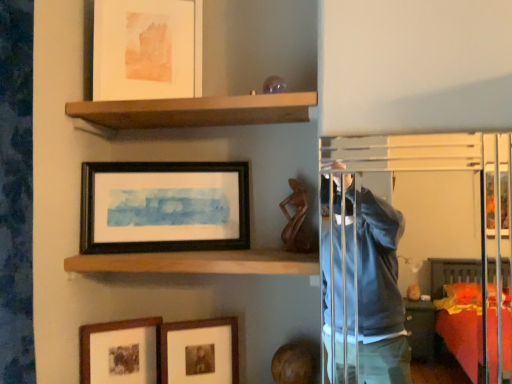
Where is `wooden shelf at center, the 2th shelf positioned from the top`? wooden shelf at center, the 2th shelf positioned from the top is located at coordinates (199, 262).

What do you see at coordinates (292, 364) in the screenshot? I see `wooden head at lower center` at bounding box center [292, 364].

What do you see at coordinates (147, 49) in the screenshot? This screenshot has width=512, height=384. I see `matte paper picture frame at upper center, the first picture frame when ordered from top to bottom` at bounding box center [147, 49].

What are the coordinates of `wooden shelf at center, the 2th shelf positioned from the top` in the screenshot? It's located at (199, 262).

You are a GUI agent. You are given a task and a screenshot of the screen. Output one action in this format:
    pyautogui.click(x=<x>, y=<y>)
    Task: Click on the picture frame that is the 3rd object to the right of the matte wooden picture frame at lower left, marked as the 1th picture frame in a bottom-to-top arrangement, starting at the anchor
    The image size is (512, 384).
    Given the screenshot: What is the action you would take?
    pyautogui.click(x=200, y=351)

From the image's perspective, does matte wooden picture frame at lower center, acting as the third picture frame starting from the top, appear lower than matte wooden picture frame at lower left, the fourth picture frame from the top?

Incorrect, from the image's perspective, matte wooden picture frame at lower center, acting as the third picture frame starting from the top, is higher than matte wooden picture frame at lower left, the fourth picture frame from the top.

From a real-world perspective, is matte wooden picture frame at lower center, which appears as the 2th picture frame when ordered from the bottom, positioned above or below matte wooden picture frame at lower left, marked as the 1th picture frame in a bottom-to-top arrangement?

In terms of real-world spatial position, matte wooden picture frame at lower center, which appears as the 2th picture frame when ordered from the bottom, is above matte wooden picture frame at lower left, marked as the 1th picture frame in a bottom-to-top arrangement.

Is matte wooden picture frame at lower center, acting as the third picture frame starting from the top, touching matte wooden picture frame at lower left, marked as the 1th picture frame in a bottom-to-top arrangement?

matte wooden picture frame at lower center, acting as the third picture frame starting from the top, and matte wooden picture frame at lower left, marked as the 1th picture frame in a bottom-to-top arrangement, are clearly separated.

In terms of size, does matte paper picture frame at upper center, the first picture frame when ordered from top to bottom, appear bigger or smaller than matte wooden picture frame at lower center, which appears as the 2th picture frame when ordered from the bottom?

Considering their sizes, matte paper picture frame at upper center, the first picture frame when ordered from top to bottom, takes up more space than matte wooden picture frame at lower center, which appears as the 2th picture frame when ordered from the bottom.

Could you tell me if matte paper picture frame at upper center, the first picture frame when ordered from top to bottom, is turned towards matte wooden picture frame at lower center, acting as the third picture frame starting from the top?

No, matte paper picture frame at upper center, the first picture frame when ordered from top to bottom, is not facing towards matte wooden picture frame at lower center, acting as the third picture frame starting from the top.

From the picture: Is matte paper picture frame at upper center, the first picture frame when ordered from top to bottom, positioned in front of matte wooden picture frame at lower center, which appears as the 2th picture frame when ordered from the bottom?

No, matte paper picture frame at upper center, the first picture frame when ordered from top to bottom, is further to the viewer.

Measure the distance from matte wooden picture frame at lower center, which appears as the 2th picture frame when ordered from the bottom, to black matte picture frame at center, acting as the 3th picture frame starting from the bottom.

matte wooden picture frame at lower center, which appears as the 2th picture frame when ordered from the bottom, is 12.37 inches away from black matte picture frame at center, acting as the 3th picture frame starting from the bottom.

Could you tell me if matte wooden picture frame at lower center, acting as the third picture frame starting from the top, is facing black matte picture frame at center, arranged as the 2th picture frame when viewed from the top?

No, matte wooden picture frame at lower center, acting as the third picture frame starting from the top, is not oriented towards black matte picture frame at center, arranged as the 2th picture frame when viewed from the top.

From the image's perspective, who appears lower, matte wooden picture frame at lower center, acting as the third picture frame starting from the top, or black matte picture frame at center, acting as the 3th picture frame starting from the bottom?

matte wooden picture frame at lower center, acting as the third picture frame starting from the top, is shown below in the image.

What's the angular difference between matte wooden picture frame at lower center, which appears as the 2th picture frame when ordered from the bottom, and black matte picture frame at center, acting as the 3th picture frame starting from the bottom,'s facing directions?

There is a 5.76-degree angle between the facing directions of matte wooden picture frame at lower center, which appears as the 2th picture frame when ordered from the bottom, and black matte picture frame at center, acting as the 3th picture frame starting from the bottom.

Which of these two, matte wooden picture frame at lower left, the fourth picture frame from the top, or black matte picture frame at center, acting as the 3th picture frame starting from the bottom, is wider?

With larger width is black matte picture frame at center, acting as the 3th picture frame starting from the bottom.

Between matte wooden picture frame at lower left, the fourth picture frame from the top, and black matte picture frame at center, acting as the 3th picture frame starting from the bottom, which one appears on the right side from the viewer's perspective?

black matte picture frame at center, acting as the 3th picture frame starting from the bottom.

Is matte wooden picture frame at lower left, the fourth picture frame from the top, to the left or to the right of matte paper picture frame at upper center, the first picture frame when ordered from top to bottom, in the image?

In the image, matte wooden picture frame at lower left, the fourth picture frame from the top, appears on the left side of matte paper picture frame at upper center, the first picture frame when ordered from top to bottom.

Considering the relative positions of matte wooden picture frame at lower left, the fourth picture frame from the top, and matte paper picture frame at upper center, the first picture frame when ordered from top to bottom, in the image provided, is matte wooden picture frame at lower left, the fourth picture frame from the top, behind matte paper picture frame at upper center, the first picture frame when ordered from top to bottom,?

No, matte wooden picture frame at lower left, the fourth picture frame from the top, is in front of matte paper picture frame at upper center, the first picture frame when ordered from top to bottom.

Is matte wooden picture frame at lower left, marked as the 1th picture frame in a bottom-to-top arrangement, beside matte paper picture frame at upper center, the first picture frame when ordered from top to bottom?

No.

From a real-world perspective, between matte wooden picture frame at lower left, the fourth picture frame from the top, and matte paper picture frame at upper center, the first picture frame when ordered from top to bottom, who is vertically higher?

matte paper picture frame at upper center, the first picture frame when ordered from top to bottom.

Are transparent glass door at upper right and wooden head at lower center located far from each other?

No, transparent glass door at upper right is not far away from wooden head at lower center.

Which is closer, (452,165) or (301,368)?

Point (452,165).

Based on their sizes in the image, would you say transparent glass door at upper right is bigger or smaller than wooden head at lower center?

Considering their sizes, transparent glass door at upper right takes up more space than wooden head at lower center.

Is matte wooden picture frame at lower left, the fourth picture frame from the top, wider or thinner than matte wooden picture frame at lower center, which appears as the 2th picture frame when ordered from the bottom?

Clearly, matte wooden picture frame at lower left, the fourth picture frame from the top, has more width compared to matte wooden picture frame at lower center, which appears as the 2th picture frame when ordered from the bottom.

Considering the relative positions of matte wooden picture frame at lower left, the fourth picture frame from the top, and matte wooden picture frame at lower center, acting as the third picture frame starting from the top, in the image provided, is matte wooden picture frame at lower left, the fourth picture frame from the top, to the right of matte wooden picture frame at lower center, acting as the third picture frame starting from the top, from the viewer's perspective?

In fact, matte wooden picture frame at lower left, the fourth picture frame from the top, is to the left of matte wooden picture frame at lower center, acting as the third picture frame starting from the top.

From a real-world perspective, is matte wooden picture frame at lower left, the fourth picture frame from the top, below matte wooden picture frame at lower center, which appears as the 2th picture frame when ordered from the bottom?

Indeed, from a real-world perspective, matte wooden picture frame at lower left, the fourth picture frame from the top, is positioned beneath matte wooden picture frame at lower center, which appears as the 2th picture frame when ordered from the bottom.

Choose the correct answer: Is matte wooden picture frame at lower left, marked as the 1th picture frame in a bottom-to-top arrangement, inside matte wooden picture frame at lower center, which appears as the 2th picture frame when ordered from the bottom, or outside it?

matte wooden picture frame at lower left, marked as the 1th picture frame in a bottom-to-top arrangement, is located beyond the bounds of matte wooden picture frame at lower center, which appears as the 2th picture frame when ordered from the bottom.

In order to click on the 1st picture frame behind when counting from the matte wooden picture frame at lower left, marked as the 1th picture frame in a bottom-to-top arrangement in this screenshot , I will do `click(200, 351)`.

The image size is (512, 384). In order to click on the 2nd picture frame counting from the left of the matte wooden picture frame at lower center, which appears as the 2th picture frame when ordered from the bottom in this screenshot , I will do `click(147, 49)`.

Which object lies nearer to the anchor point wooden shelf at center, the 2th shelf positioned from the top, matte wooden picture frame at lower center, acting as the third picture frame starting from the top, or transparent glass door at upper right?

Based on the image, matte wooden picture frame at lower center, acting as the third picture frame starting from the top, appears to be nearer to wooden shelf at center, the 2th shelf positioned from the top.

When comparing their distances from wooden shelf at center, the 2th shelf positioned from the top, does brown wooden shelf at upper center, the 2th shelf in the bottom-to-top sequence, or wooden head at lower center seem further?

brown wooden shelf at upper center, the 2th shelf in the bottom-to-top sequence, is further to wooden shelf at center, the 2th shelf positioned from the top.

When comparing their distances from matte wooden picture frame at lower center, acting as the third picture frame starting from the top, does transparent glass door at upper right or wooden head at lower center seem further?

transparent glass door at upper right lies further to matte wooden picture frame at lower center, acting as the third picture frame starting from the top, than the other object.

Based on their spatial positions, is wooden head at lower center or black matte picture frame at center, acting as the 3th picture frame starting from the bottom, further from wooden shelf at center, the 2th shelf positioned from the top?

Among the two, wooden head at lower center is located further to wooden shelf at center, the 2th shelf positioned from the top.

Based on their spatial positions, is matte wooden picture frame at lower center, acting as the third picture frame starting from the top, or matte wooden picture frame at lower left, marked as the 1th picture frame in a bottom-to-top arrangement, further from brown wooden shelf at upper center, the 2th shelf in the bottom-to-top sequence?

matte wooden picture frame at lower left, marked as the 1th picture frame in a bottom-to-top arrangement, lies further to brown wooden shelf at upper center, the 2th shelf in the bottom-to-top sequence, than the other object.

Based on their spatial positions, is matte wooden picture frame at lower center, acting as the third picture frame starting from the top, or brown wooden shelf at upper center, which is the 1th shelf from top to bottom, further from wooden head at lower center?

Based on the image, brown wooden shelf at upper center, which is the 1th shelf from top to bottom, appears to be further to wooden head at lower center.

Estimate the real-world distances between objects in this image. Which object is closer to wooden shelf at center, which is counted as the first shelf, starting from the bottom, matte wooden picture frame at lower left, marked as the 1th picture frame in a bottom-to-top arrangement, or matte wooden picture frame at lower center, acting as the third picture frame starting from the top?

Based on the image, matte wooden picture frame at lower center, acting as the third picture frame starting from the top, appears to be nearer to wooden shelf at center, which is counted as the first shelf, starting from the bottom.

Which object lies further to the anchor point brown wooden shelf at upper center, the 2th shelf in the bottom-to-top sequence, matte wooden picture frame at lower left, the fourth picture frame from the top, or wooden head at lower center?

The object further to brown wooden shelf at upper center, the 2th shelf in the bottom-to-top sequence, is wooden head at lower center.

Identify the location of glass door that lies between matte paper picture frame at upper center, the first picture frame when ordered from top to bottom, and wooden head at lower center from top to bottom. Image resolution: width=512 pixels, height=384 pixels. (373, 280).

The height and width of the screenshot is (384, 512). Identify the location of shelf that lies between brown wooden shelf at upper center, which is the 1th shelf from top to bottom, and matte wooden picture frame at lower left, the fourth picture frame from the top, from top to bottom. (199, 262).

Where is `picture frame between black matte picture frame at center, acting as the 3th picture frame starting from the bottom, and matte wooden picture frame at lower left, marked as the 1th picture frame in a bottom-to-top arrangement, vertically`? This screenshot has height=384, width=512. picture frame between black matte picture frame at center, acting as the 3th picture frame starting from the bottom, and matte wooden picture frame at lower left, marked as the 1th picture frame in a bottom-to-top arrangement, vertically is located at coordinates (200, 351).

Image resolution: width=512 pixels, height=384 pixels. I want to click on shelf between black matte picture frame at center, arranged as the 2th picture frame when viewed from the top, and wooden head at lower center from top to bottom, so [199, 262].